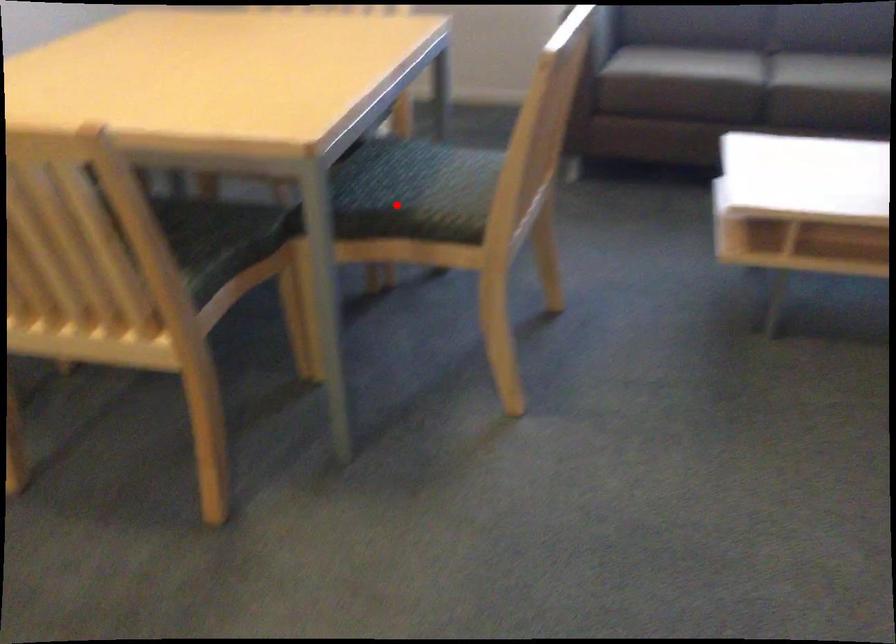
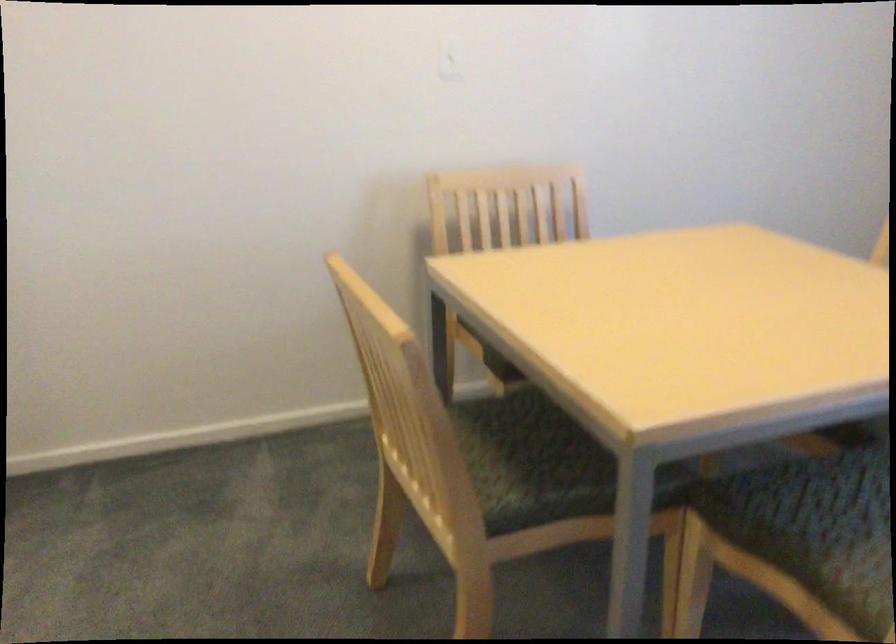
Question: I am providing you with two images of the same scene from different viewpoints. In image1, a red point is highlighted. Considering the same 3D point in image2, which of the following is correct?

Choices:
 (A) It is closer
 (B) It is farther

Answer: (A)